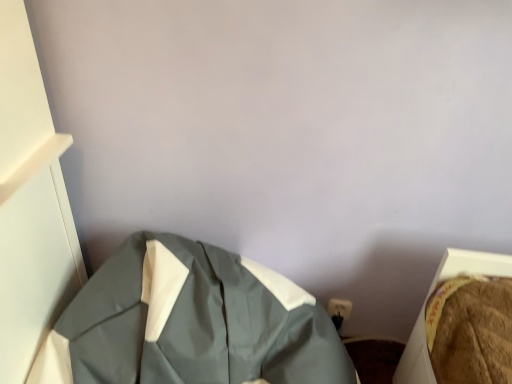
Question: Should I look upward or downward to see matte gray jacket at center?

Choices:
 (A) up
 (B) down

Answer: (B)